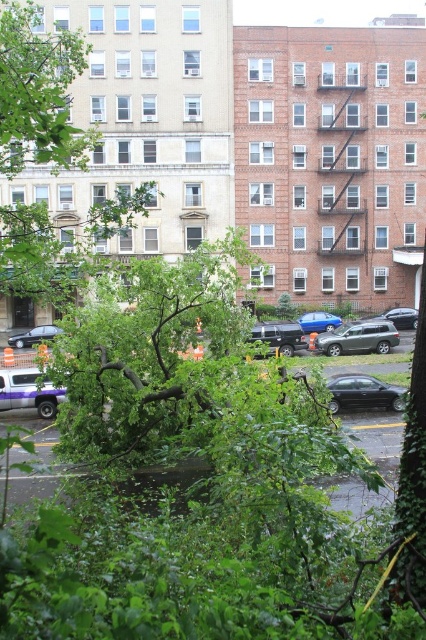
You are a delivery driver who needs to park your vehicle in this parking area. You have a delivery van that is the same size as the shiny silver sedan at lower left. There is a spot next to the blue metallic car at center. Can your van fit in that spot?

The shiny silver sedan at lower left is bigger than the blue metallic car at center. Since your van is the same size as the shiny silver sedan, it might be too large for the spot next to the blue metallic car unless the spot is designed for larger vehicles. Check if the parking spot accommodates larger vehicles before proceeding.

You are standing in the parking area and see the purple matte truck at lower left. If you want to reach the entrance of the building on the left, which is 100 feet away from you, can you walk straight ahead without any obstacles?

The purple matte truck at lower left is 70.11 feet away from you. Since the entrance of the building on the left is 100 feet away, you can walk straight ahead as the truck is closer and not blocking your path to the entrance.